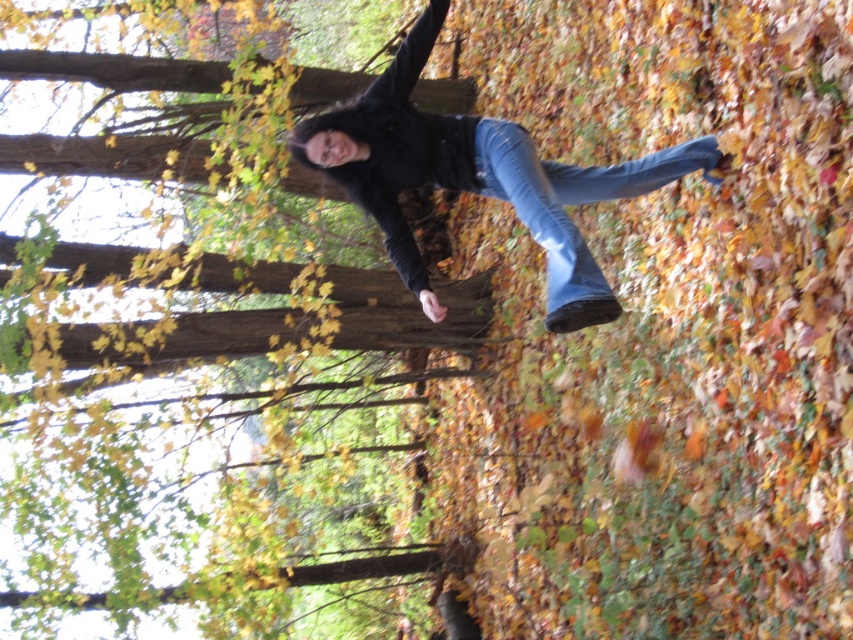
Question: Is denim jeans at center smaller than blue denim jeans at center?

Choices:
 (A) yes
 (B) no

Answer: (B)

Question: Which point is farther to the camera?

Choices:
 (A) (712, 157)
 (B) (471, 316)
 (C) (650, 157)

Answer: (B)

Question: Which of the following is the farthest from the observer?

Choices:
 (A) pyautogui.click(x=471, y=122)
 (B) pyautogui.click(x=685, y=164)
 (C) pyautogui.click(x=93, y=353)

Answer: (C)

Question: Is blue denim jeans at center bigger than brown wood tree at center?

Choices:
 (A) no
 (B) yes

Answer: (B)

Question: Does blue denim jeans at center have a smaller size compared to brown wood tree at center?

Choices:
 (A) yes
 (B) no

Answer: (B)

Question: Which point appears farthest from the camera in this image?

Choices:
 (A) (375, 317)
 (B) (708, 157)

Answer: (A)